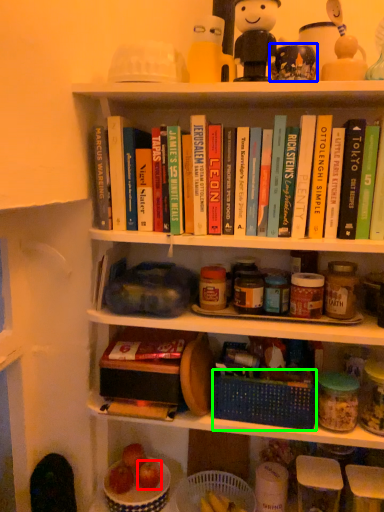
Question: Which object is positioned farthest from apple (highlighted by a red box)? Select from toy (highlighted by a blue box) and basket (highlighted by a green box).

Choices:
 (A) toy
 (B) basket

Answer: (A)